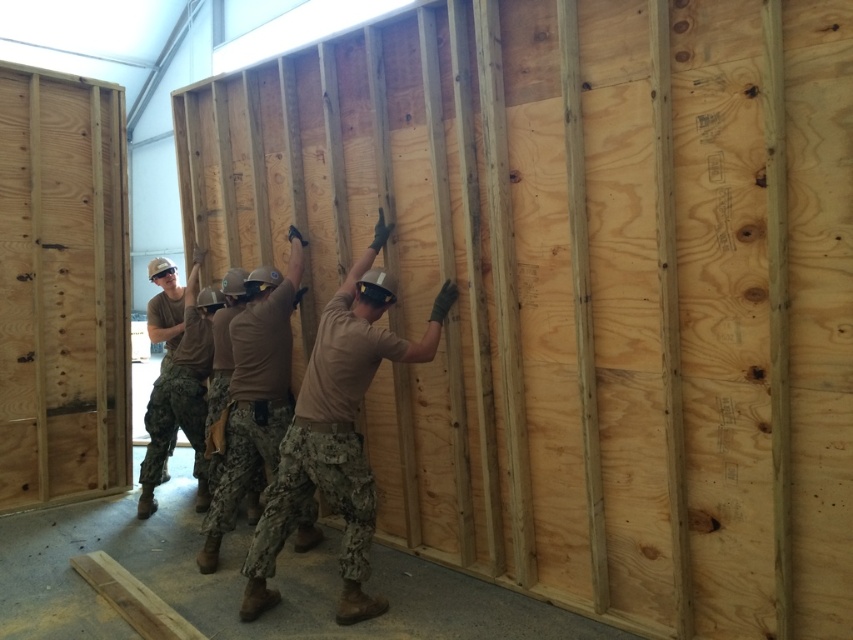
You are standing at the point where the construction workers are working. You want to move to a safe area 3 meters away from your current position. Is the distance between you and the point at coordinates point (271, 486) sufficient to reach the safe area?

The distance between you and point (271, 486) is 3.41 meters, which is greater than 3 meters, so yes, moving to that point would place you in the safe area.